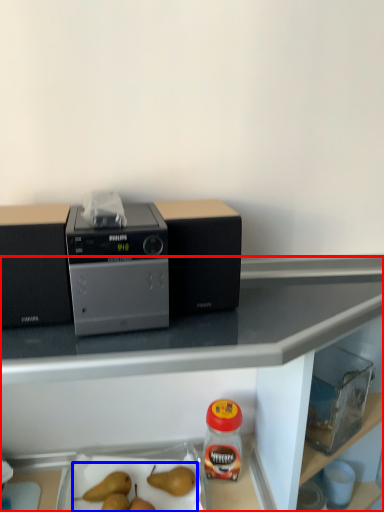
Question: Which object appears closest to the camera in this image, table (highlighted by a red box) or fruit (highlighted by a blue box)?

Choices:
 (A) table
 (B) fruit

Answer: (A)